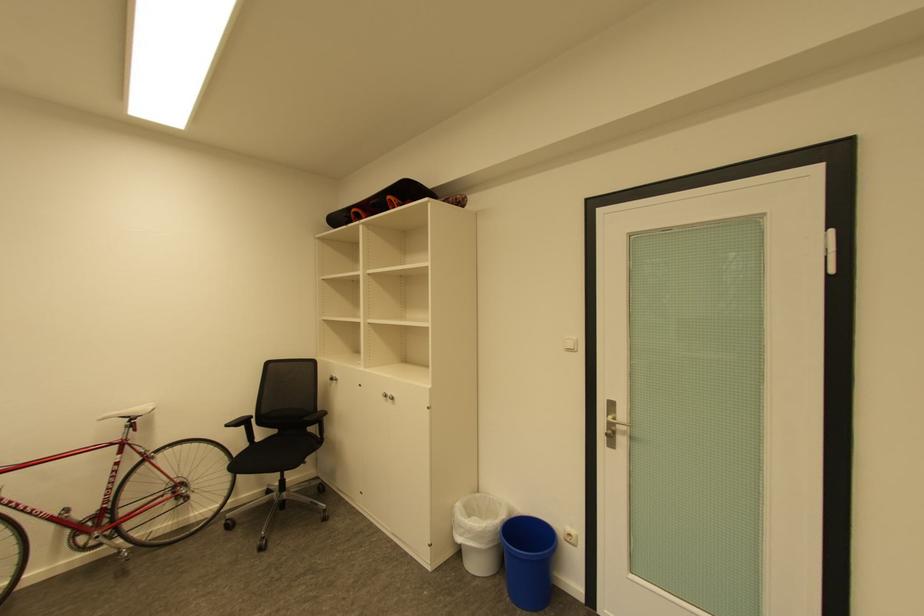
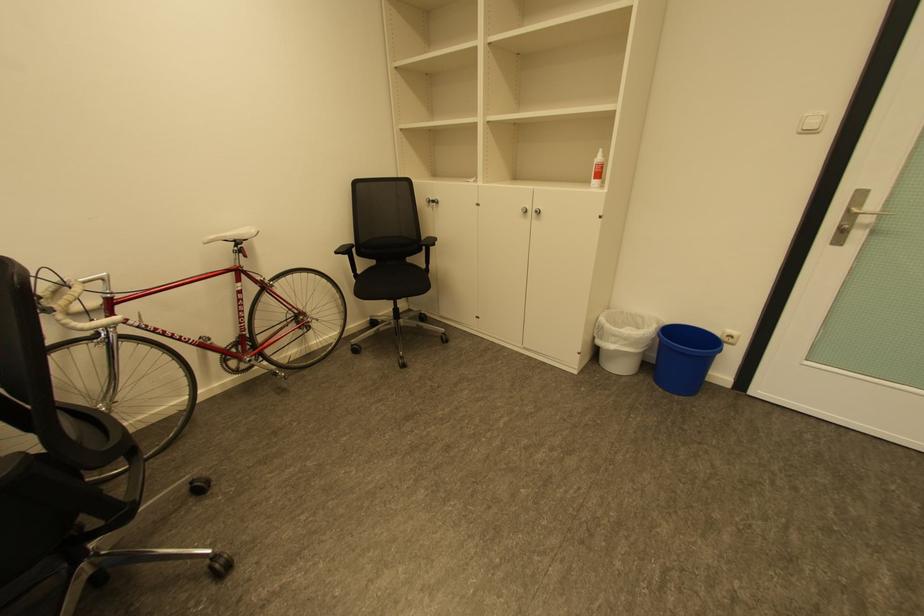
Locate, in the second image, the point that corresponds to point 137,418 in the first image.

(241, 241)